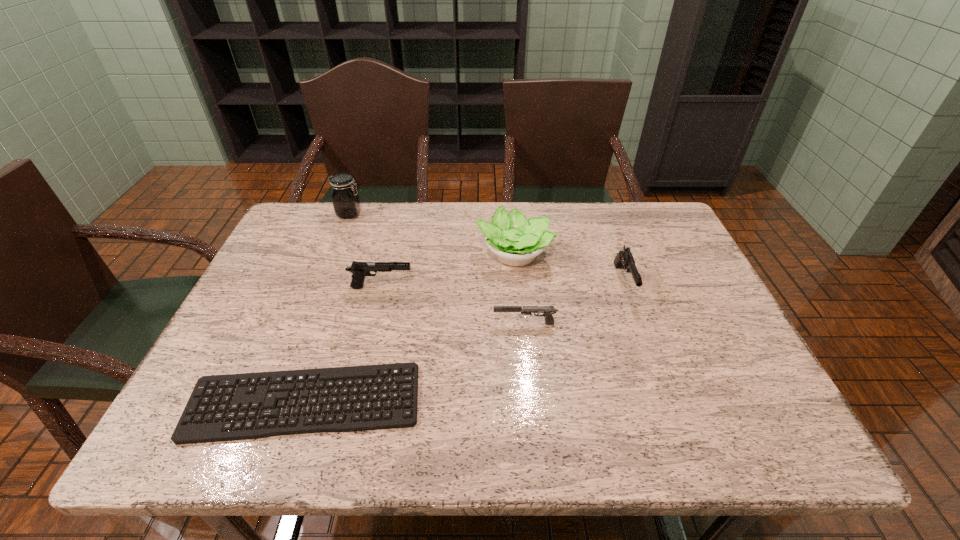
Locate an element on the screen. Image resolution: width=960 pixels, height=540 pixels. vacant space positioned on the right of the lettuce is located at coordinates (622, 254).

This screenshot has height=540, width=960. Find the location of `free space located at the end of the barrel of the rightmost object`. free space located at the end of the barrel of the rightmost object is located at coordinates (647, 347).

Where is `vacant space positioned 0.150m at the aiming end of the leftmost gun`? The width and height of the screenshot is (960, 540). vacant space positioned 0.150m at the aiming end of the leftmost gun is located at coordinates (470, 287).

Where is `vacant area situated at the muzzle end of the nearest gun`? vacant area situated at the muzzle end of the nearest gun is located at coordinates (369, 323).

The width and height of the screenshot is (960, 540). Find the location of `free space located 0.270m at the muzzle end of the nearest gun`. free space located 0.270m at the muzzle end of the nearest gun is located at coordinates (381, 323).

Locate an element on the screen. vacant space positioned 0.300m at the muzzle end of the nearest gun is located at coordinates (369, 323).

Find the location of a particular element. This screenshot has width=960, height=540. vacant space situated on the back of the computer keyboard is located at coordinates [x=348, y=272].

Where is `jar that is at the far edge`? This screenshot has height=540, width=960. jar that is at the far edge is located at coordinates (346, 202).

Where is `lettuce located in the far edge section of the desktop`? Image resolution: width=960 pixels, height=540 pixels. lettuce located in the far edge section of the desktop is located at coordinates (516, 241).

Identify the location of object present at the near edge. Image resolution: width=960 pixels, height=540 pixels. (205, 432).